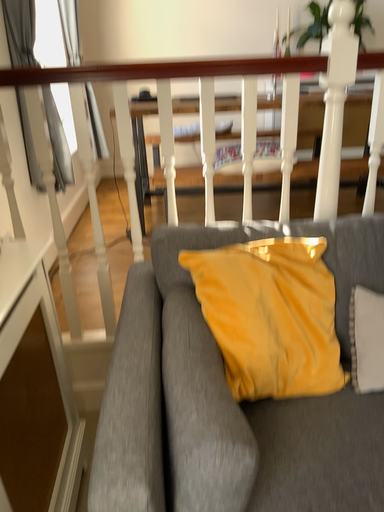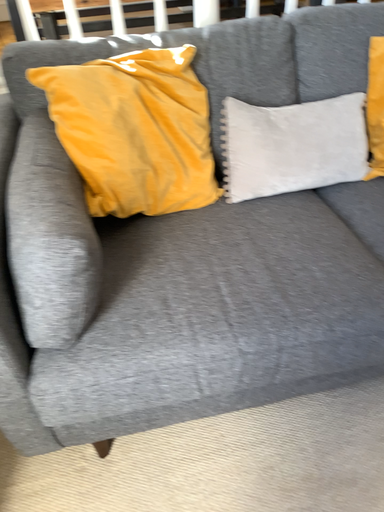
Question: Which way did the camera rotate in the video?

Choices:
 (A) rotated upward
 (B) rotated downward

Answer: (B)